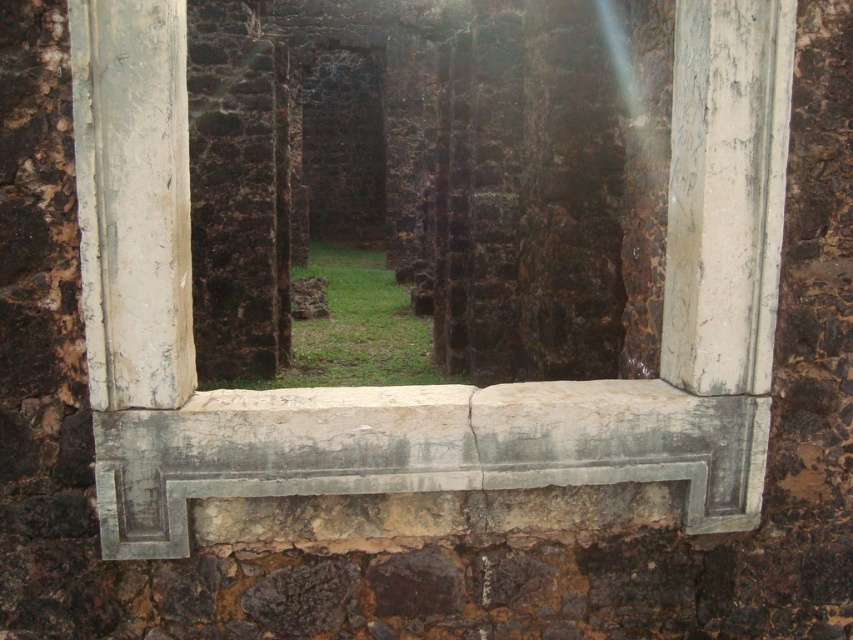
Consider the image. You are standing in an ancient stone structure and looking through the window. You see the white weathered wood at center and the gray stone window sill at center. Which one is positioned to the left?

The white weathered wood at center is positioned to the left of the gray stone window sill at center.

You are standing inside an ancient stone building and looking through the window. You want to place a small potted plant on the surface closest to you. Which object should you choose between the white weathered wood at center and the gray stone window sill at center?

The white weathered wood at center is in front of the gray stone window sill at center, so the surface closest to you is the white weathered wood at center. Place the potted plant there.